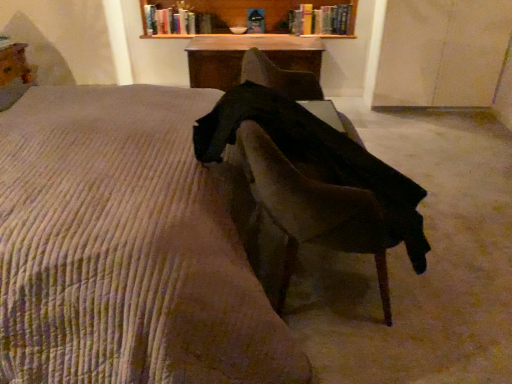
Question: Would you say wooden table at center, the first table from the right, is part of dark fabric chair at center's contents?

Choices:
 (A) no
 (B) yes

Answer: (A)

Question: Considering the relative sizes of dark fabric chair at center and wooden table at center, the first table from the right, in the image provided, is dark fabric chair at center bigger than wooden table at center, the first table from the right,?

Choices:
 (A) yes
 (B) no

Answer: (A)

Question: Considering the relative sizes of dark fabric chair at center and wooden table at center, which ranks as the second table in left-to-right order, in the image provided, is dark fabric chair at center thinner than wooden table at center, which ranks as the second table in left-to-right order,?

Choices:
 (A) yes
 (B) no

Answer: (B)

Question: Does dark fabric chair at center have a greater width compared to wooden table at center, the second table viewed from the front?

Choices:
 (A) yes
 (B) no

Answer: (A)

Question: Is dark fabric chair at center looking in the opposite direction of wooden table at center, marked as the 1th table in a back-to-front arrangement?

Choices:
 (A) no
 (B) yes

Answer: (A)

Question: In terms of size, does corduroy bedspread at center appear bigger or smaller than hardcover book at upper center, the first book from the right?

Choices:
 (A) big
 (B) small

Answer: (A)

Question: From a real-world perspective, is corduroy bedspread at center physically located above or below hardcover book at upper center, the first book from the right?

Choices:
 (A) below
 (B) above

Answer: (A)

Question: From the image's perspective, is corduroy bedspread at center positioned above or below hardcover book at upper center, the first book from the right?

Choices:
 (A) above
 (B) below

Answer: (B)

Question: Which is correct: corduroy bedspread at center is inside hardcover book at upper center, which is the second book in left-to-right order, or outside of it?

Choices:
 (A) outside
 (B) inside

Answer: (A)

Question: From a real-world perspective, is hardcover book at upper center, the first book from the right, above or below corduroy bedspread at center?

Choices:
 (A) below
 (B) above

Answer: (B)

Question: Considering their positions, is hardcover book at upper center, the first book from the right, located in front of or behind corduroy bedspread at center?

Choices:
 (A) front
 (B) behind

Answer: (B)

Question: From the image's perspective, is hardcover book at upper center, which is the second book in left-to-right order, located above or below corduroy bedspread at center?

Choices:
 (A) below
 (B) above

Answer: (B)

Question: Is point (337, 19) closer or farther from the camera than point (153, 185)?

Choices:
 (A) farther
 (B) closer

Answer: (A)

Question: From a real-world perspective, is corduroy bedspread at center physically located above or below hardcover book at upper center, which is counted as the first book, starting from the left?

Choices:
 (A) above
 (B) below

Answer: (B)

Question: Do you think corduroy bedspread at center is within hardcover book at upper center, which is counted as the first book, starting from the left, or outside of it?

Choices:
 (A) inside
 (B) outside

Answer: (B)